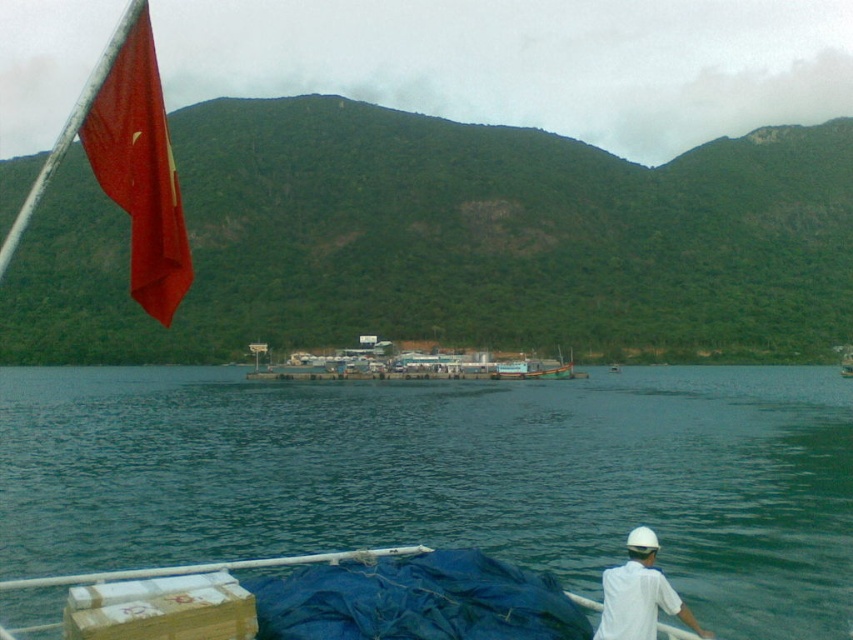
Where is `green water at center`? This screenshot has height=640, width=853. green water at center is located at coordinates (447, 476).

Does point (379, 465) come behind point (129, 273)?

No, (379, 465) is in front of (129, 273).

Locate an element on the screen. The width and height of the screenshot is (853, 640). green water at center is located at coordinates (447, 476).

Does green water at center appear on the left side of white matte shirt at lower right?

Indeed, green water at center is positioned on the left side of white matte shirt at lower right.

Locate an element on the screen. Image resolution: width=853 pixels, height=640 pixels. green water at center is located at coordinates (447, 476).

You are a GUI agent. You are given a task and a screenshot of the screen. Output one action in this format:
    pyautogui.click(x=<x>, y=<y>)
    Task: Click on the green water at center
    
    Given the screenshot: What is the action you would take?
    pyautogui.click(x=447, y=476)

At what (x,y) coordinates should I click in order to perform the action: click on green water at center. Please return your answer as a coordinate pair (x, y). Looking at the image, I should click on (447, 476).

Can you confirm if red matte flag at upper left is positioned to the left of white matte shirt at lower right?

Indeed, red matte flag at upper left is positioned on the left side of white matte shirt at lower right.

Which is in front, point (160, 147) or point (653, 584)?

Point (160, 147) is in front.

Find the location of `red matte flag at upper left`. red matte flag at upper left is located at coordinates (138, 164).